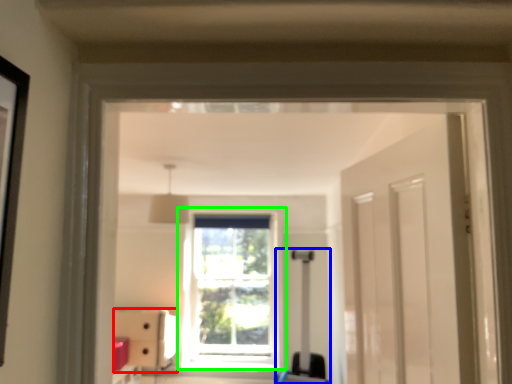
Question: Which object is positioned closest to furniture (highlighted by a red box)? Select from luggage (highlighted by a blue box) and window (highlighted by a green box).

Choices:
 (A) luggage
 (B) window

Answer: (B)